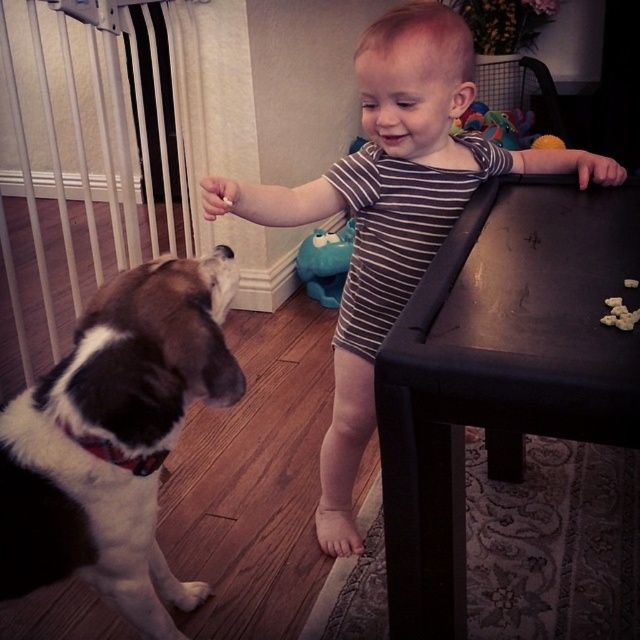
Question: Where is brown and white fur at left located in relation to brown crumbly food at table right in the image?

Choices:
 (A) right
 (B) left

Answer: (B)

Question: Is plush blue elephant at upper center above brown crumbly food at table right?

Choices:
 (A) no
 (B) yes

Answer: (B)

Question: Which object appears closest to the camera in this image?

Choices:
 (A) brown and white fur at left
 (B) matte blue plush toy at center
 (C) brown crumbly food at table right

Answer: (C)

Question: Which point is farther to the camera?

Choices:
 (A) plush blue elephant at upper center
 (B) brown crumbly food at table right
 (C) brown and white fur at left
 (D) matte blue plush toy at center

Answer: (A)

Question: Which object is closer to the camera taking this photo?

Choices:
 (A) matte blue plush toy at center
 (B) striped cotton onesie at center

Answer: (B)

Question: Can you confirm if striped cotton onesie at center is smaller than matte blue plush toy at center?

Choices:
 (A) no
 (B) yes

Answer: (A)